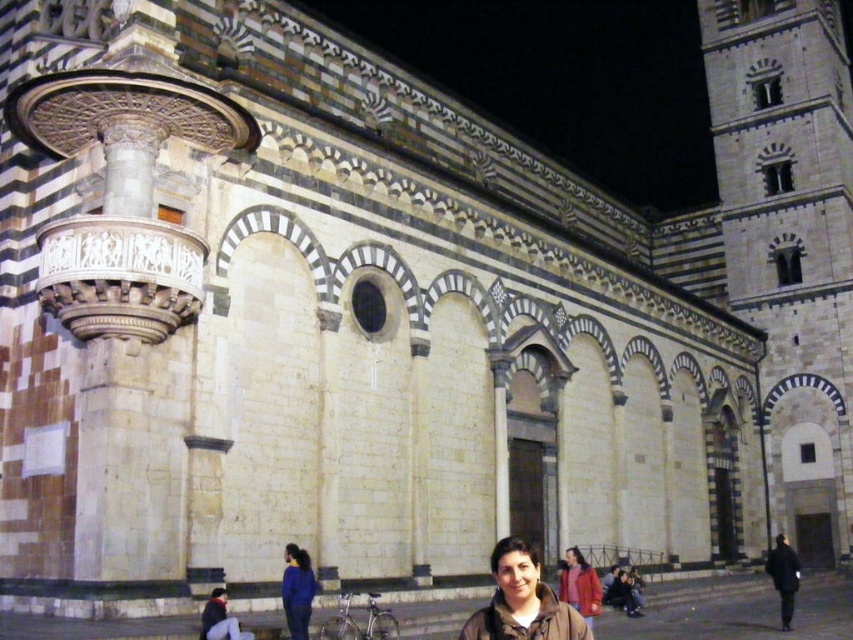
You are a photographer trying to capture the entire gray stone tower at right and the blue fabric jacket at lower center in one frame. Based on their sizes, which object should you focus on first to ensure both are fully visible in the photo?

The gray stone tower at right is wider than the blue fabric jacket at lower center. To capture both in one frame, focus on positioning the camera so the wider gray stone tower at right is centered, allowing space for the narrower blue fabric jacket at lower center.

You are a photographer trying to capture both the blue fabric jacket at lower center and the red woolen coat at lower center in a single frame. Since you want them to appear equally sized in the photo, which one should you move closer to the camera?

The blue fabric jacket at lower center has a lesser width compared to the red woolen coat at lower center, so you should move the blue fabric jacket at lower center closer to the camera to make it appear larger in the photo.

You are standing at the center of the image and want to find the gray stone tower at right. According to the coordinates provided, in which direction should you look to locate it?

The gray stone tower at right is located at coordinates point (790,244), which means it is to the right and slightly above the center of the image. You should look to your right and slightly upwards to locate it.